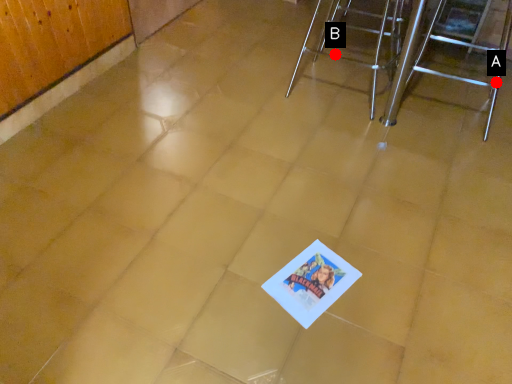
Question: Two points are circled on the image, labeled by A and B beside each circle. Among these points, which one is nearest to the camera?

Choices:
 (A) A is closer
 (B) B is closer

Answer: (A)